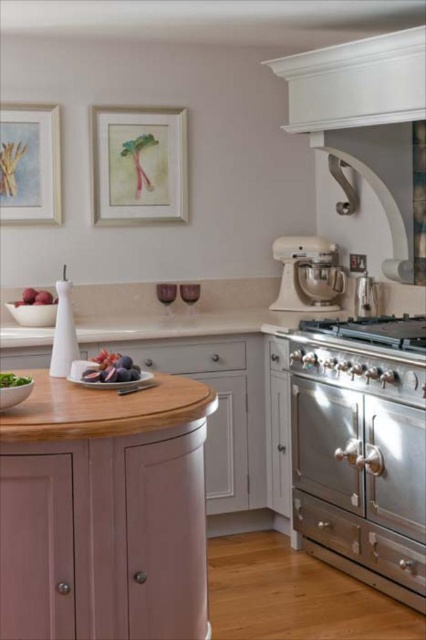
You are a chef preparing a salad and need to place the green leafy salad at left onto the wooden table at center. Can you directly move it straight down without moving it sideways?

The wooden table at center is below the green leafy salad at left, so yes, you can move the green leafy salad at left straight down to the wooden table at center without needing to move it sideways.

You are a kitchen designer planning to place a 4 feet long appliance between the stainless steel drawer at lower right and the matte white drawer at center. Based on the current spacing, will the appliance fit comfortably between them?

The stainless steel drawer at lower right is 3.86 feet from the matte white drawer at center. Since the appliance is 4 feet long, it is slightly longer than the available space, so it may not fit comfortably between them.

You are a chef preparing to place a large baking tray into either the stainless steel oven at right or the stainless steel drawer at lower right. Based on their sizes, which appliance can accommodate the tray more comfortably?

The stainless steel oven at right has a greater height compared to the stainless steel drawer at lower right, so the large baking tray will fit more comfortably in the stainless steel oven at right.